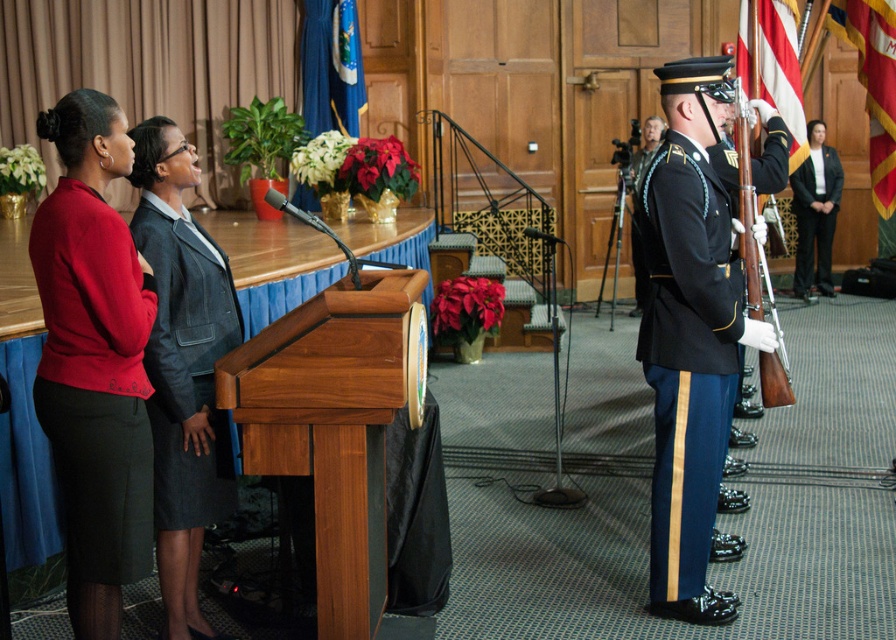
Question: Which object is the closest to the black wool suit at right?

Choices:
 (A) gray wool suit at center
 (B) shiny blue fabric uniform at center
 (C) shiny black uniform at right

Answer: (B)

Question: Can you confirm if gray wool suit at center is wider than shiny blue fabric uniform at center?

Choices:
 (A) no
 (B) yes

Answer: (A)

Question: Does shiny black uniform at right appear over black wool suit at right?

Choices:
 (A) yes
 (B) no

Answer: (B)

Question: Which point is closer to the camera?

Choices:
 (A) gray wool suit at center
 (B) shiny blue fabric uniform at center

Answer: (A)

Question: Is shiny black uniform at right smaller than shiny blue fabric uniform at center?

Choices:
 (A) no
 (B) yes

Answer: (B)

Question: Which point is farther from the camera taking this photo?

Choices:
 (A) (716, 227)
 (B) (179, 474)

Answer: (A)